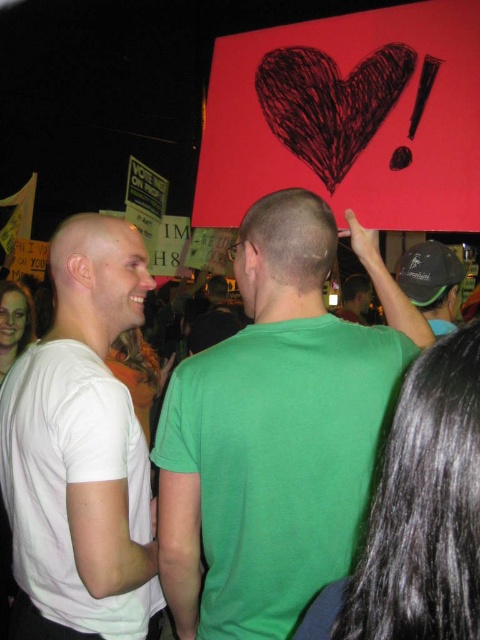
What are the coordinates of the white matte bald head at left in the image?

The white matte bald head at left is located at coordinates point (97, 280).

You are a photographer trying to capture the protest scene. You notice two points in the image at coordinates point (278, 436) and point (67, 218). Which point is more in the foreground?

Point (278, 436) is closer to the camera than point (67, 218), so it is more in the foreground.

You are a photographer trying to capture a photo of the white matte bald head at left and the matte green shirt at center. Based on their positions, which one should you focus on first to ensure both are in the frame?

The white matte bald head at left is located below the matte green shirt at center, so you should focus on the matte green shirt at center first to ensure both are in the frame.